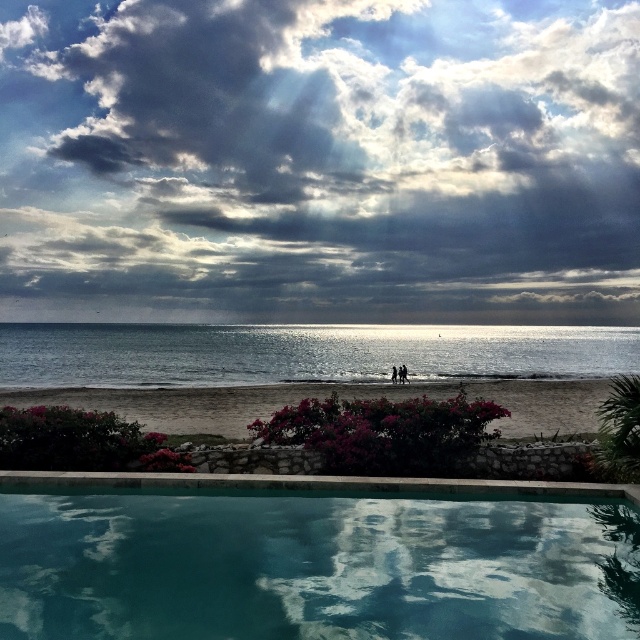
Does point (412, 186) lie in front of point (1, 604)?

No.

Consider the image. Is cloudy sky at upper center smaller than teal glass swimming pool at bottom?

No, cloudy sky at upper center is not smaller than teal glass swimming pool at bottom.

Where is `cloudy sky at upper center`? This screenshot has width=640, height=640. cloudy sky at upper center is located at coordinates (321, 157).

Identify the location of shiny silver water at center. The image size is (640, 640). (301, 353).

Can you confirm if shiny silver water at center is positioned above beige sand beach at lower center?

Yes, shiny silver water at center is above beige sand beach at lower center.

Is point (150, 362) more distant than point (579, 384)?

Yes.

You are a GUI agent. You are given a task and a screenshot of the screen. Output one action in this format:
    pyautogui.click(x=<x>, y=<y>)
    Task: Click on the shiny silver water at center
    This screenshot has width=640, height=640.
    Given the screenshot: What is the action you would take?
    301,353

Does point (29, 634) come in front of point (134, 376)?

Yes.

The width and height of the screenshot is (640, 640). What do you see at coordinates (316, 566) in the screenshot? I see `teal glass swimming pool at bottom` at bounding box center [316, 566].

Does point (211, 612) come closer to viewer compared to point (541, 352)?

Yes, it is in front of point (541, 352).

Locate an element on the screen. teal glass swimming pool at bottom is located at coordinates (316, 566).